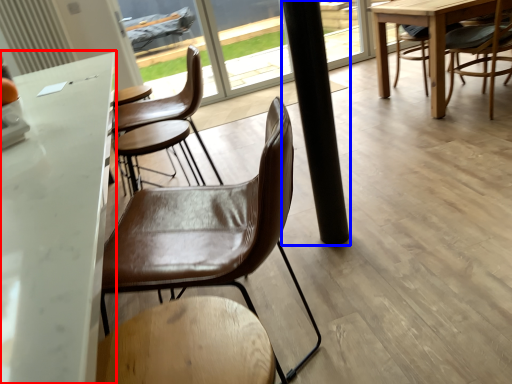
Question: Which of the following is the closest to the observer, table (highlighted by a red box) or pillar (highlighted by a blue box)?

Choices:
 (A) table
 (B) pillar

Answer: (A)